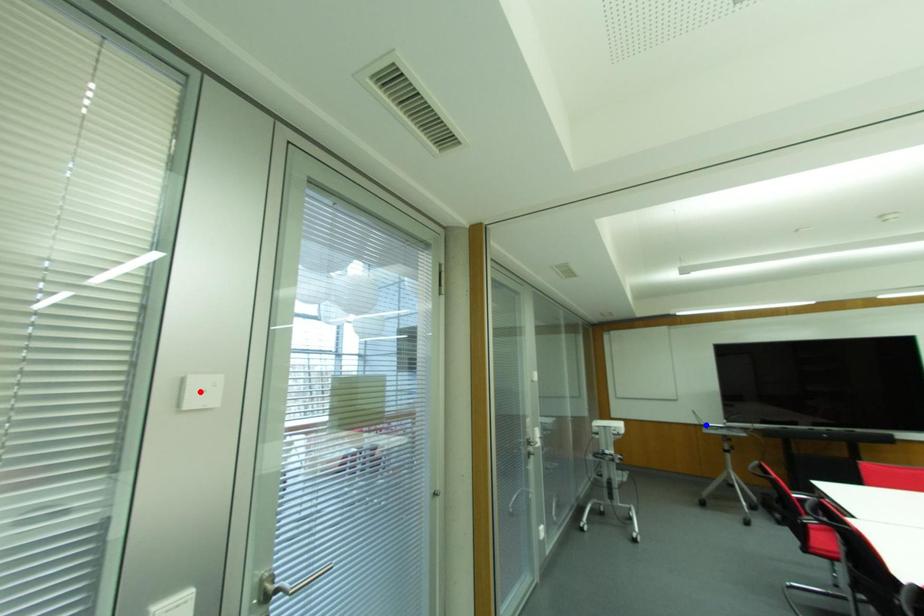
Question: Two points are marked on the image. Which point is closer to the camera?

Choices:
 (A) Blue point is closer.
 (B) Red point is closer.

Answer: (B)